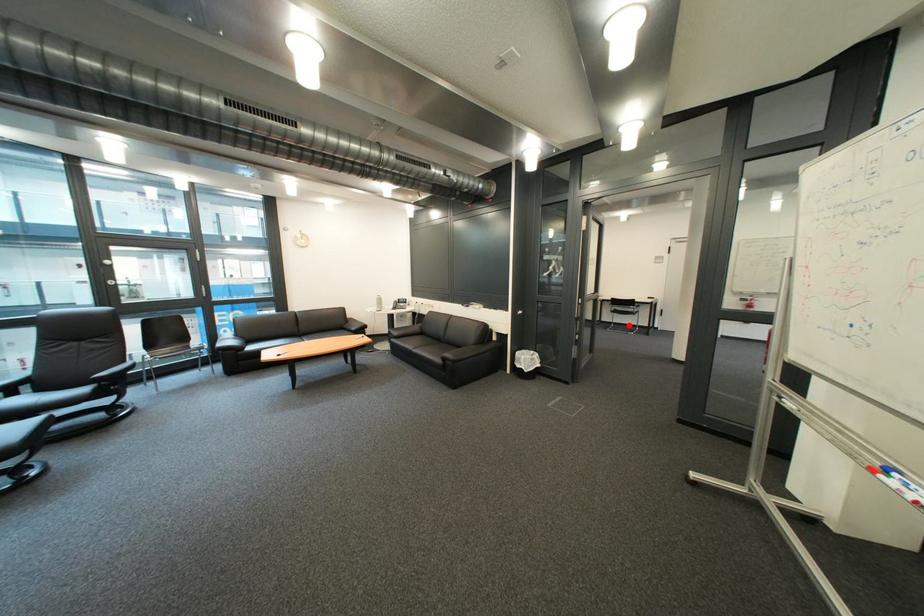
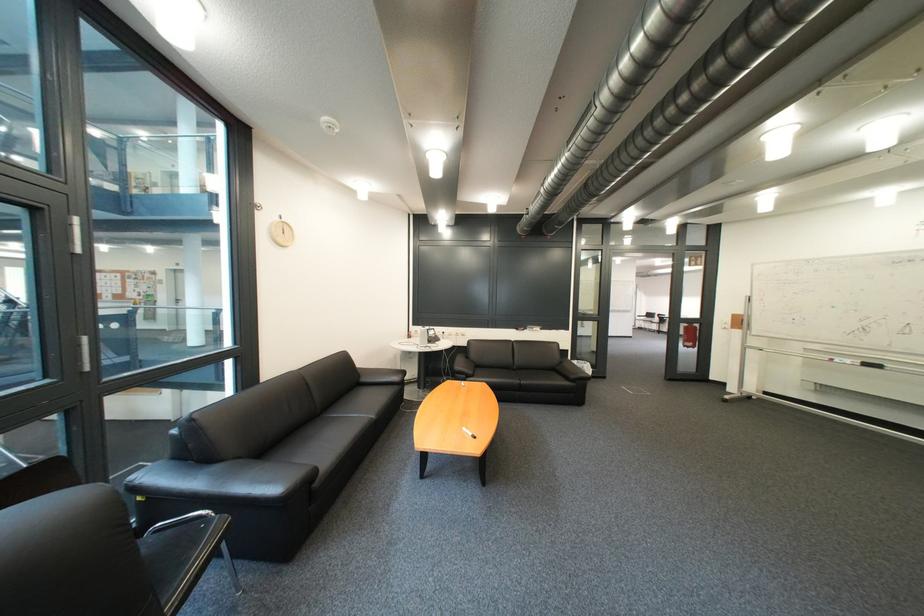
Question: I am providing you with two images of the same scene from different viewpoints. A red point is marked on the first image. At the location where the point appears in image 1, is it still visible in image 2?

Choices:
 (A) Yes
 (B) No

Answer: (B)